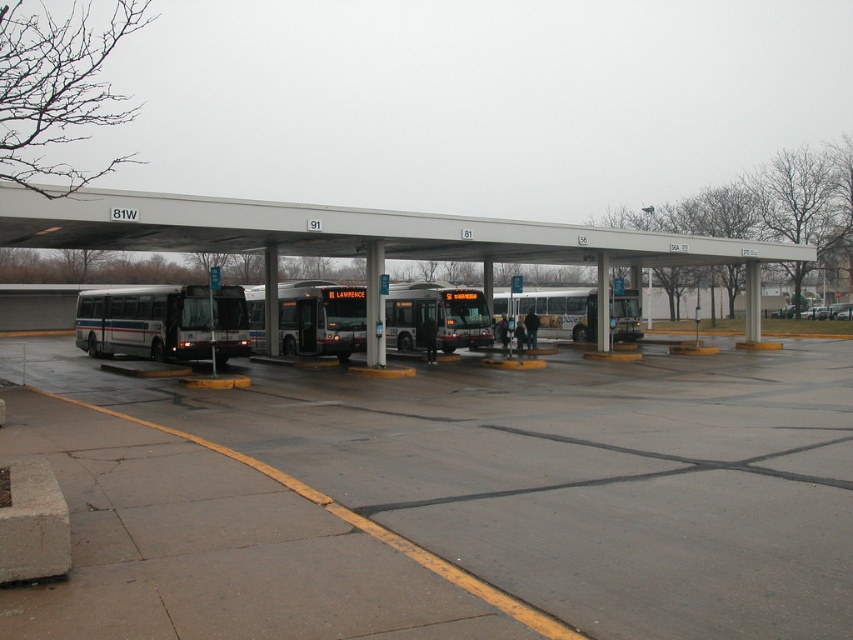
Does matte black bus at left appear on the right side of white metallic bus at center?

Incorrect, matte black bus at left is not on the right side of white metallic bus at center.

Does matte black bus at left have a smaller size compared to white metallic bus at center?

Yes, matte black bus at left is smaller than white metallic bus at center.

Is point (189, 296) positioned behind point (590, 316)?

That is False.

The width and height of the screenshot is (853, 640). Find the location of `matte black bus at left`. matte black bus at left is located at coordinates (163, 323).

Does concrete parking lot at center have a greater width compared to matte black bus at left?

Yes.

From the picture: Is concrete parking lot at center smaller than matte black bus at left?

Indeed, concrete parking lot at center has a smaller size compared to matte black bus at left.

Describe the element at coordinates (445, 500) in the screenshot. I see `concrete parking lot at center` at that location.

The image size is (853, 640). Identify the location of concrete parking lot at center. (445, 500).

Is concrete parking lot at center positioned behind white metallic bus at center?

No.

You are a GUI agent. You are given a task and a screenshot of the screen. Output one action in this format:
    pyautogui.click(x=<x>, y=<y>)
    Task: Click on the concrete parking lot at center
    
    Given the screenshot: What is the action you would take?
    pyautogui.click(x=445, y=500)

Where is `concrete parking lot at center`? The width and height of the screenshot is (853, 640). concrete parking lot at center is located at coordinates (445, 500).

I want to click on concrete parking lot at center, so click(x=445, y=500).